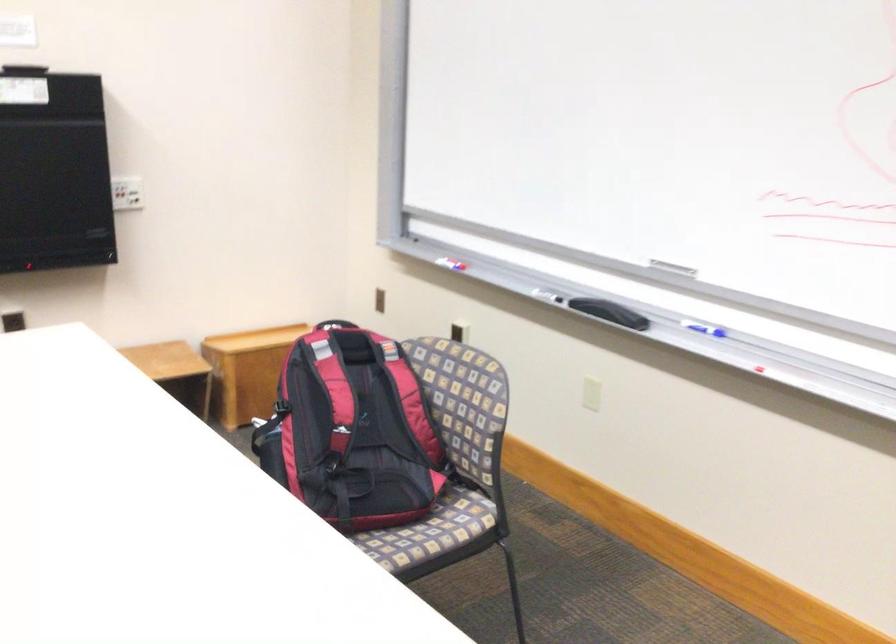
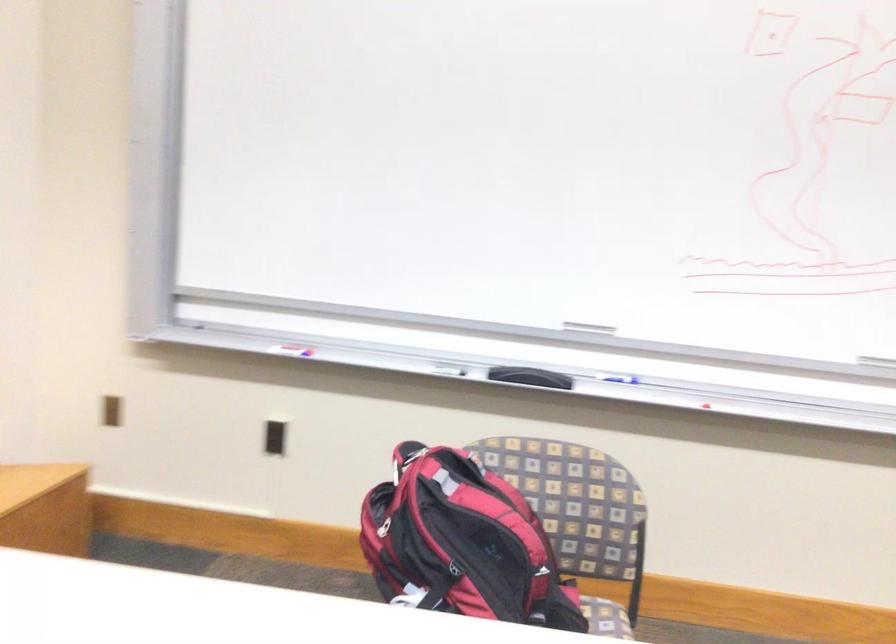
Where in the second image is the point corresponding to point 360,406 from the first image?

(478, 542)